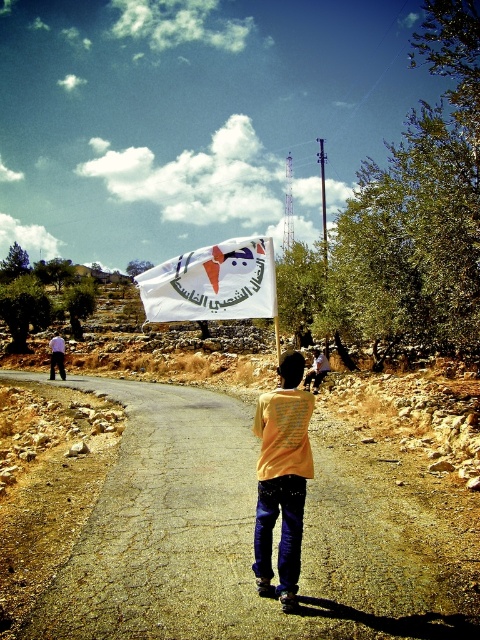
Question: Is yellow matte shirt at center to the right of white fabric flag at center from the viewer's perspective?

Choices:
 (A) no
 (B) yes

Answer: (B)

Question: Is yellow matte shirt at center behind white fabric flag at center?

Choices:
 (A) yes
 (B) no

Answer: (B)

Question: Which object appears closest to the camera in this image?

Choices:
 (A) white fabric flag at center
 (B) yellow matte shirt at center

Answer: (B)

Question: Does yellow matte shirt at center appear on the right side of white fabric flag at center?

Choices:
 (A) yes
 (B) no

Answer: (A)

Question: Among these points, which one is nearest to the camera?

Choices:
 (A) (273, 435)
 (B) (148, 314)

Answer: (A)

Question: Which point is closer to the camera taking this photo?

Choices:
 (A) (257, 560)
 (B) (253, 307)

Answer: (A)